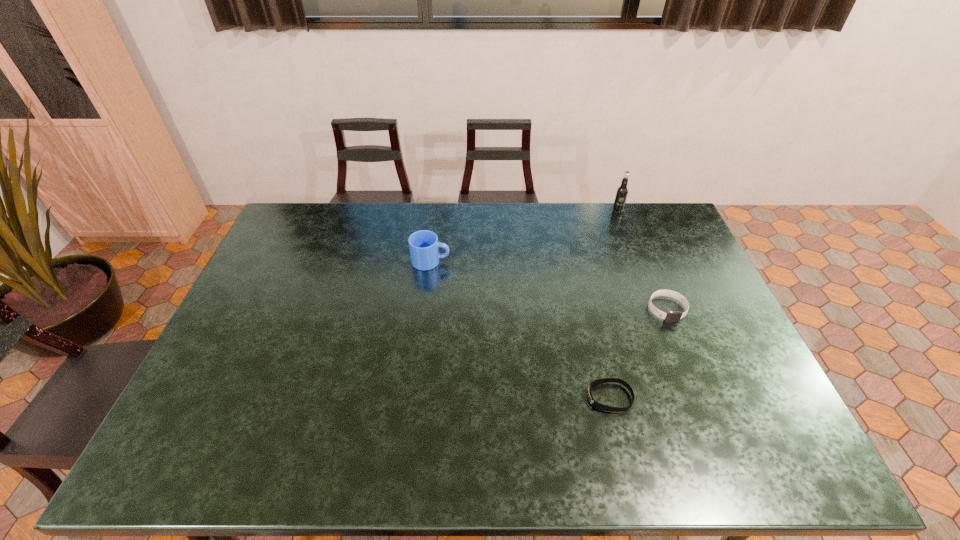
Where is `vacant area located 0.350m on the outer surface of the third farthest object`? This screenshot has width=960, height=540. vacant area located 0.350m on the outer surface of the third farthest object is located at coordinates (718, 436).

Image resolution: width=960 pixels, height=540 pixels. Find the location of `vacant point located on the display of the nearer wristband`. vacant point located on the display of the nearer wristband is located at coordinates (434, 397).

The height and width of the screenshot is (540, 960). Find the location of `free space located on the display of the nearer wristband`. free space located on the display of the nearer wristband is located at coordinates (516, 397).

The height and width of the screenshot is (540, 960). I want to click on free spot located 0.190m on the display of the nearer wristband, so click(x=513, y=397).

The height and width of the screenshot is (540, 960). I want to click on object that is positioned at the far edge, so click(x=622, y=191).

Locate an element on the screen. object present at the right edge is located at coordinates (671, 316).

Find the location of a particular element. The height and width of the screenshot is (540, 960). free space at the far edge of the desktop is located at coordinates (551, 203).

Identify the location of vacant area at the left edge of the desktop. This screenshot has width=960, height=540. (243, 380).

The width and height of the screenshot is (960, 540). What are the coordinates of `vacant region at the right edge` in the screenshot? It's located at (670, 284).

Locate an element on the screen. free region at the far left corner of the desktop is located at coordinates (319, 217).